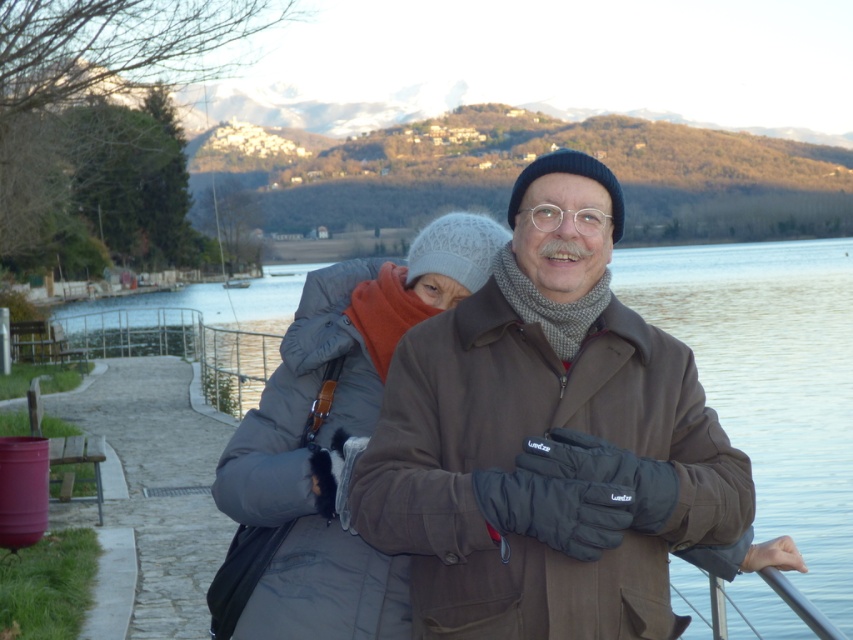
Question: Which object is farther from the camera taking this photo?

Choices:
 (A) white plastic boat at center
 (B) clear water at center
 (C) gray down jacket at center
 (D) brown quilted jacket at center

Answer: (A)

Question: Is brown quilted jacket at center to the right of white plastic boat at center from the viewer's perspective?

Choices:
 (A) yes
 (B) no

Answer: (A)

Question: Among these points, which one is nearest to the camera?

Choices:
 (A) (416, 461)
 (B) (277, 280)
 (C) (352, 268)

Answer: (A)

Question: Which is farther from the gray down jacket at center?

Choices:
 (A) white plastic boat at center
 (B) clear water at center
 (C) brown quilted jacket at center

Answer: (A)

Question: Is brown quilted jacket at center bigger than white plastic boat at center?

Choices:
 (A) yes
 (B) no

Answer: (A)

Question: Is brown quilted jacket at center bigger than clear water at center?

Choices:
 (A) yes
 (B) no

Answer: (B)